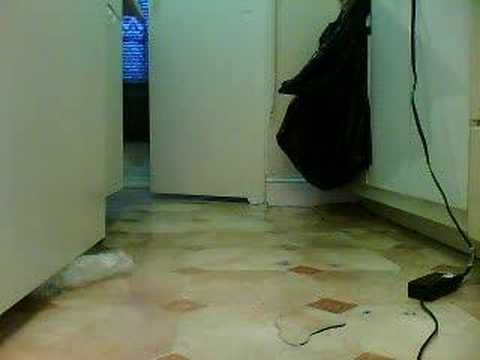
The height and width of the screenshot is (360, 480). I want to click on wiring that is black at the wall area, so click(426, 147).